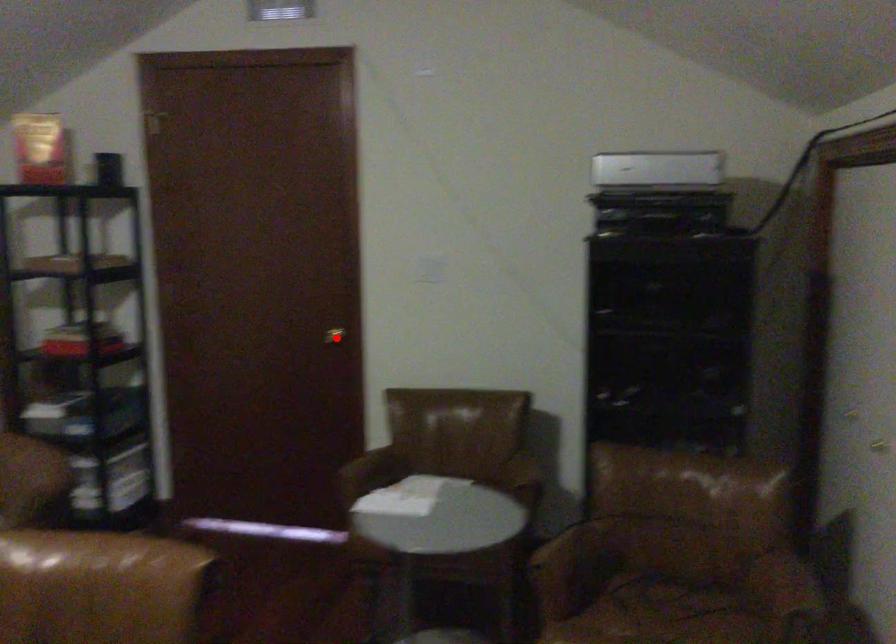
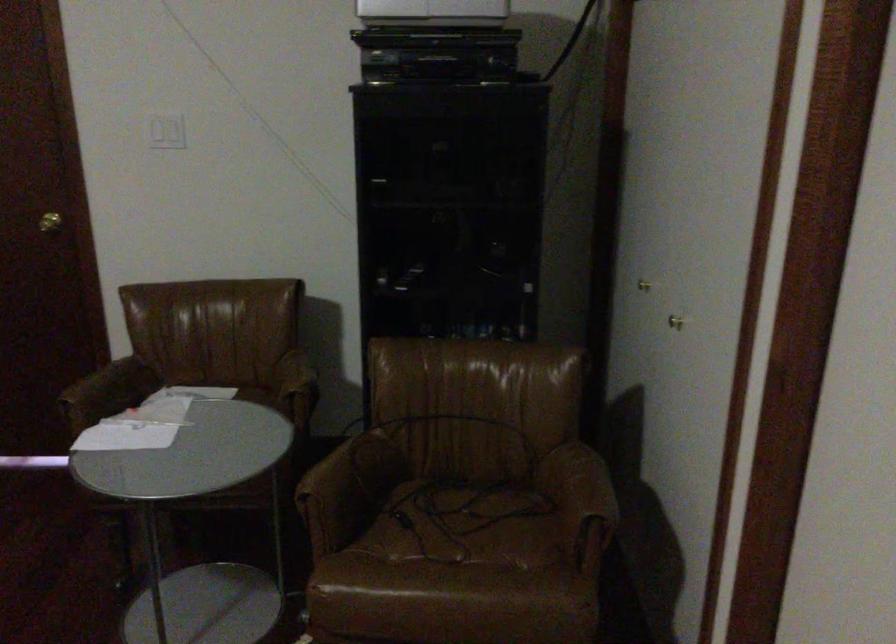
Question: A red point is marked in image1. In image2, is the corresponding 3D point closer to the camera or farther? Reply with the corresponding letter.

Choices:
 (A) The corresponding 3D point is closer.
 (B) The corresponding 3D point is farther.

Answer: (A)